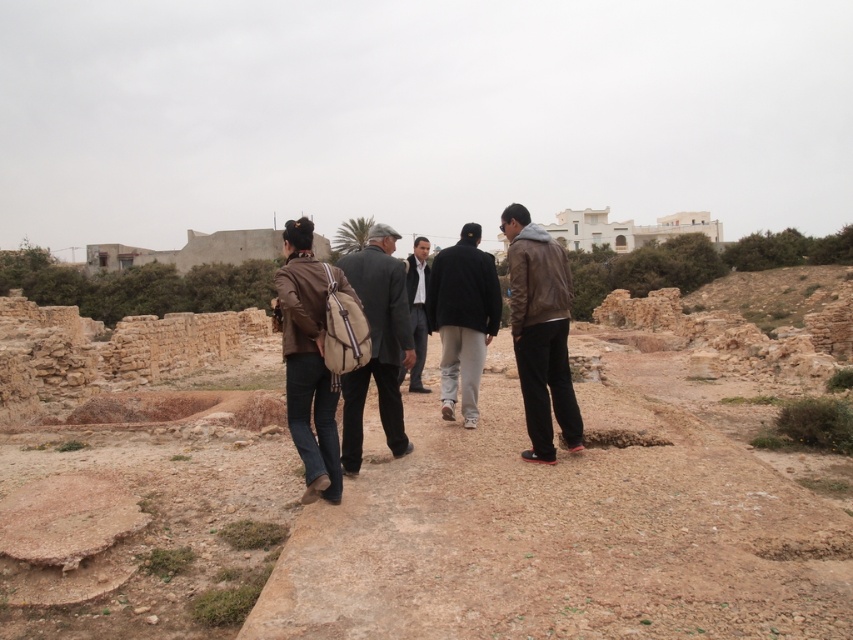
Question: Is the position of brown leather jacket at center more distant than that of matte brown leather jacket at center?

Choices:
 (A) yes
 (B) no

Answer: (A)

Question: Which object is positioned farthest from the dark gray suit at center?

Choices:
 (A) black leather jacket at center
 (B) dark brown leather jacket at center
 (C) matte brown leather jacket at center

Answer: (C)

Question: Which of these objects is positioned closest to the dark gray suit at center?

Choices:
 (A) brown leather jacket at center
 (B) black leather jacket at center
 (C) dark brown leather jacket at center
 (D) brown dirt path at center

Answer: (B)

Question: In this image, where is brown dirt path at center located relative to matte brown leather jacket at center?

Choices:
 (A) below
 (B) above

Answer: (A)

Question: Which is nearer to the dark gray suit at center?

Choices:
 (A) dark brown leather jacket at center
 (B) brown leather jacket at center
 (C) matte brown leather jacket at center
 (D) brown dirt path at center

Answer: (A)

Question: Is matte brown leather jacket at center above black leather jacket at center?

Choices:
 (A) no
 (B) yes

Answer: (A)